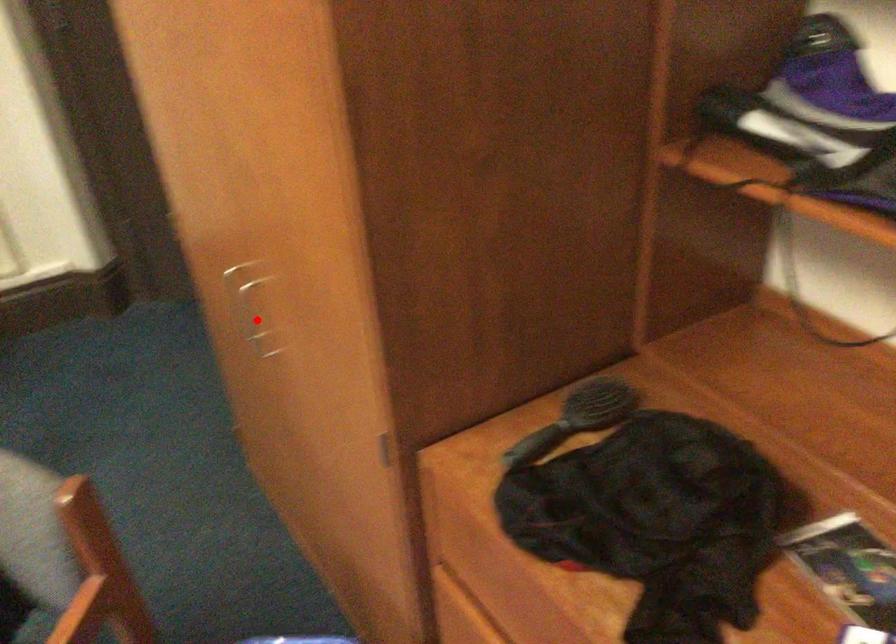
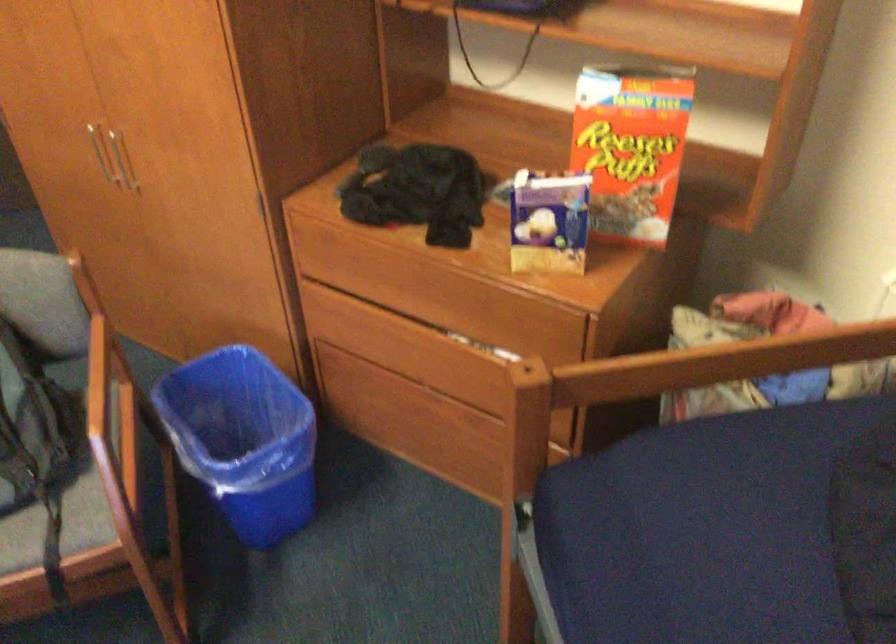
Where in the second image is the point corresponding to the highlighted location from the first image?

(122, 160)